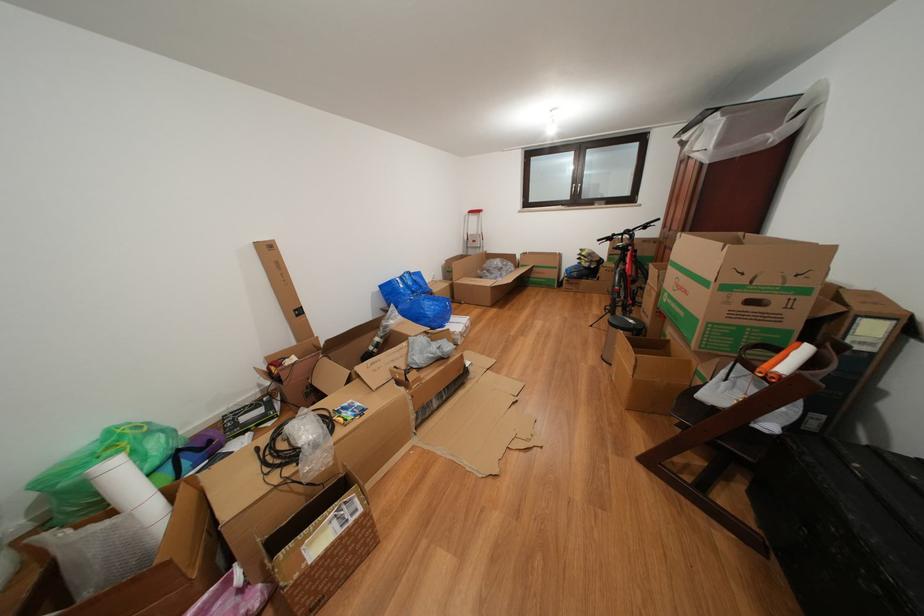
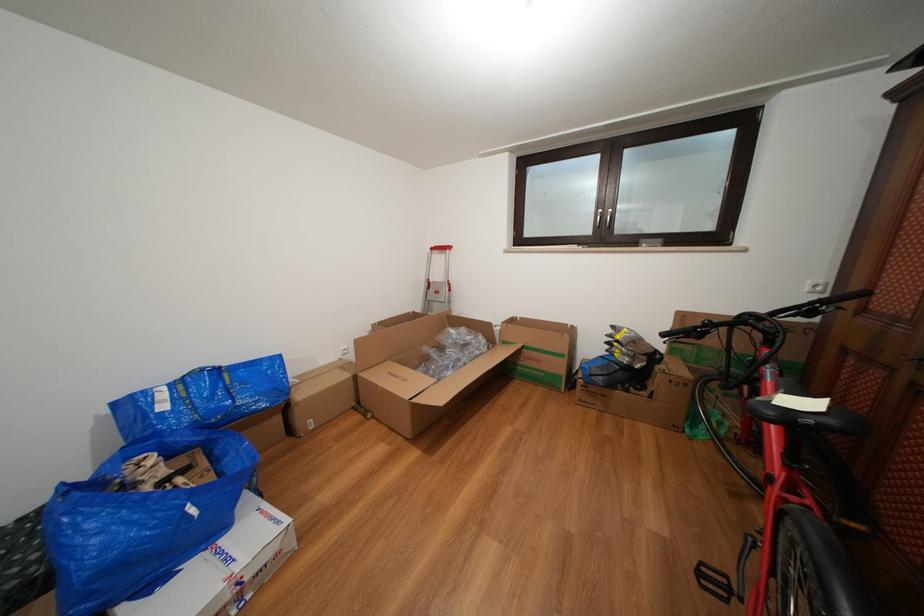
What movement of the cameraman would produce the second image?

The cameraman walked toward right, forward.